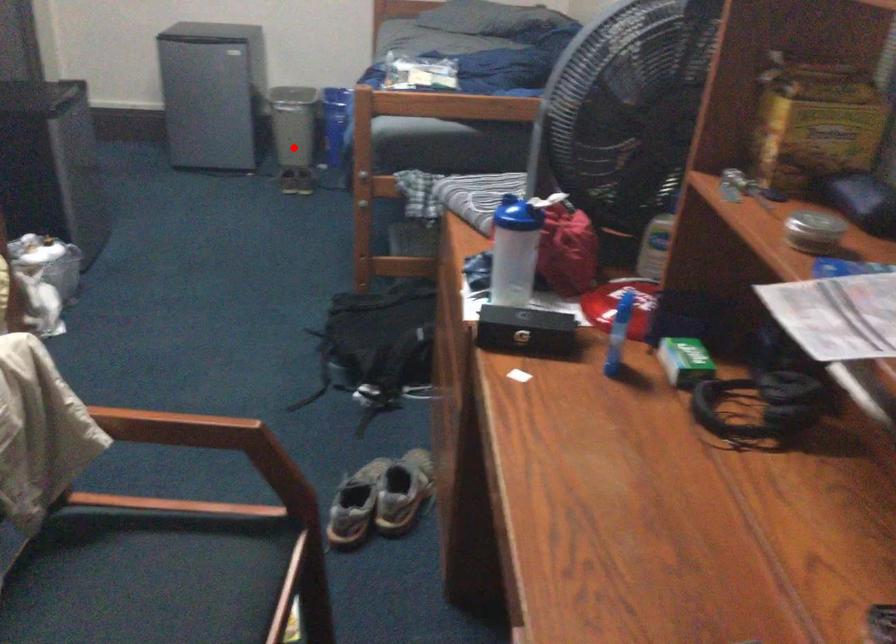
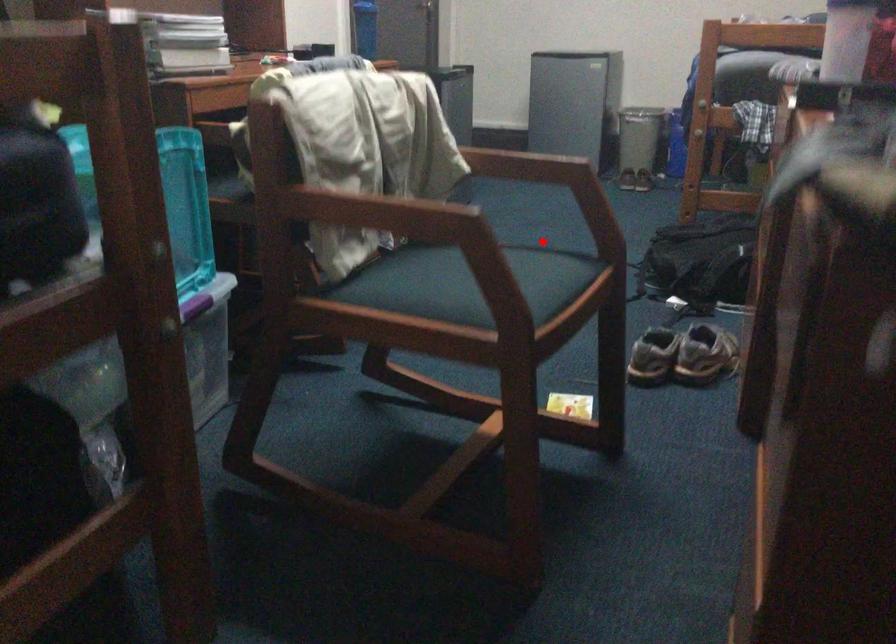
I am providing you with two images of the same scene from different viewpoints. A red point is marked on the first image and another point is marked on the second image. Does the point marked in image1 correspond to the same location as the one in image2?

No